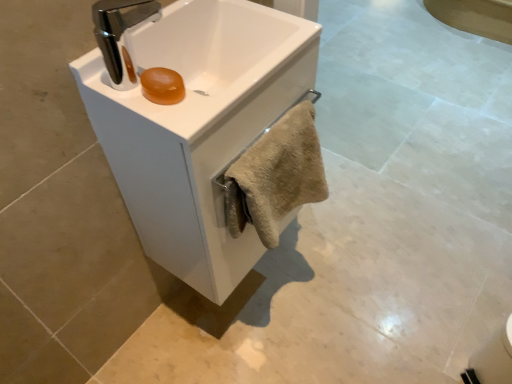
Question: Is white glossy sink at center, the 2th sink positioned from the back, wider than beige fuzzy towel at center?

Choices:
 (A) no
 (B) yes

Answer: (B)

Question: Are white glossy sink at center, the 2th sink positioned from the back, and beige fuzzy towel at center making contact?

Choices:
 (A) no
 (B) yes

Answer: (A)

Question: Is white glossy sink at center, the first sink viewed from the front, smaller than beige fuzzy towel at center?

Choices:
 (A) no
 (B) yes

Answer: (A)

Question: Does white glossy sink at center, the first sink viewed from the front, come in front of beige fuzzy towel at center?

Choices:
 (A) no
 (B) yes

Answer: (B)

Question: From the image's perspective, is white glossy sink at center, the 2th sink positioned from the back, located beneath beige fuzzy towel at center?

Choices:
 (A) no
 (B) yes

Answer: (A)

Question: Considering the relative sizes of white glossy sink at center, the 2th sink positioned from the back, and beige fuzzy towel at center in the image provided, is white glossy sink at center, the 2th sink positioned from the back, shorter than beige fuzzy towel at center?

Choices:
 (A) yes
 (B) no

Answer: (A)

Question: Is white glossy sink at center, marked as the 1th sink in a back-to-front arrangement, positioned in front of white glossy sink at center, the 2th sink positioned from the back?

Choices:
 (A) no
 (B) yes

Answer: (A)

Question: Is white glossy sink at center, the 2th sink positioned from the back, inside white glossy sink at center, marked as the 1th sink in a back-to-front arrangement?

Choices:
 (A) no
 (B) yes

Answer: (B)

Question: Is white glossy sink at center, arranged as the second sink when viewed from the front, not close to white glossy sink at center, the 2th sink positioned from the back?

Choices:
 (A) no
 (B) yes

Answer: (A)

Question: From a real-world perspective, is white glossy sink at center, arranged as the second sink when viewed from the front, below white glossy sink at center, the first sink viewed from the front?

Choices:
 (A) no
 (B) yes

Answer: (B)

Question: Is white glossy sink at center, arranged as the second sink when viewed from the front, in contact with white glossy sink at center, the first sink viewed from the front?

Choices:
 (A) yes
 (B) no

Answer: (A)

Question: Is white glossy sink at center, marked as the 1th sink in a back-to-front arrangement, smaller than white glossy sink at center, the first sink viewed from the front?

Choices:
 (A) no
 (B) yes

Answer: (A)

Question: Is white glossy sink at center, the first sink viewed from the front, touching white glossy sink at center, marked as the 1th sink in a back-to-front arrangement?

Choices:
 (A) yes
 (B) no

Answer: (A)